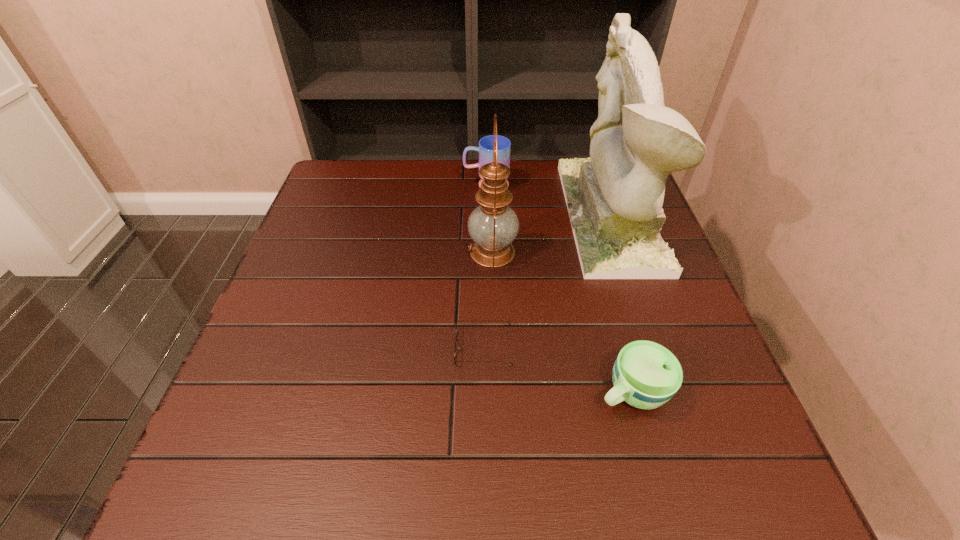
The image size is (960, 540). In order to click on vacant position in the image that satisfies the following two spatial constraints: 1. on the front side of the oil lamp; 2. on the front-facing side of the shortest object in this screenshot , I will do `click(495, 348)`.

Where is `vacant space that satisfies the following two spatial constraints: 1. on the side of the mug with the handle; 2. on the back side of the oil lamp`? vacant space that satisfies the following two spatial constraints: 1. on the side of the mug with the handle; 2. on the back side of the oil lamp is located at coordinates (488, 252).

Locate an element on the screen. vacant area that satisfies the following two spatial constraints: 1. on the front-facing side of the shortest object; 2. on the back side of the second shortest object is located at coordinates (484, 392).

You are a GUI agent. You are given a task and a screenshot of the screen. Output one action in this format:
    pyautogui.click(x=<x>, y=<y>)
    Task: Click on the blank area in the image that satisfies the following two spatial constraints: 1. on the front side of the oil lamp; 2. on the front-facing side of the shortest object
    The image size is (960, 540).
    Given the screenshot: What is the action you would take?
    pyautogui.click(x=495, y=348)